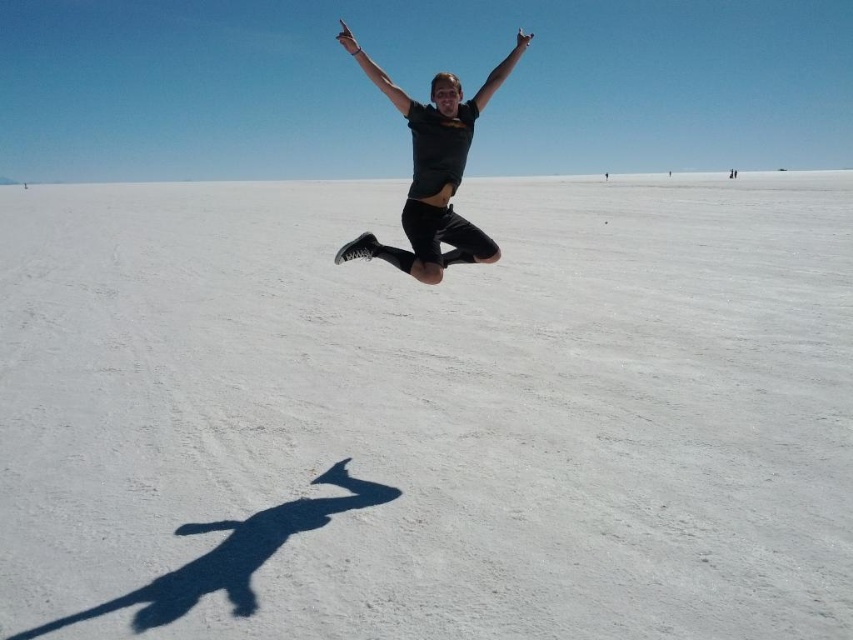
Is point (613, 360) in front of point (416, 266)?

No, (613, 360) is behind (416, 266).

Is white matte snow at center behind black matte shirt at center?

No, white matte snow at center is in front of black matte shirt at center.

At what (x,y) coordinates should I click in order to perform the action: click on white matte snow at center. Please return your answer as a coordinate pair (x, y). Looking at the image, I should click on coord(428,413).

Is white matte snow at center taller than matte black arm at upper center?

Incorrect, white matte snow at center's height is not larger of matte black arm at upper center's.

Is point (849, 376) farther from camera compared to point (378, 74)?

Yes.

You are a GUI agent. You are given a task and a screenshot of the screen. Output one action in this format:
    pyautogui.click(x=<x>, y=<y>)
    Task: Click on the white matte snow at center
    This screenshot has width=853, height=640.
    Given the screenshot: What is the action you would take?
    pyautogui.click(x=428, y=413)

Is black matte shirt at center to the left of matte black arm at upper center from the viewer's perspective?

In fact, black matte shirt at center is to the right of matte black arm at upper center.

Can you confirm if black matte shirt at center is positioned to the right of matte black arm at upper center?

Yes, black matte shirt at center is to the right of matte black arm at upper center.

From the picture: Who is more forward, [410,268] or [358,52]?

Point [358,52]

Where is `black matte shirt at center`? black matte shirt at center is located at coordinates (433, 170).